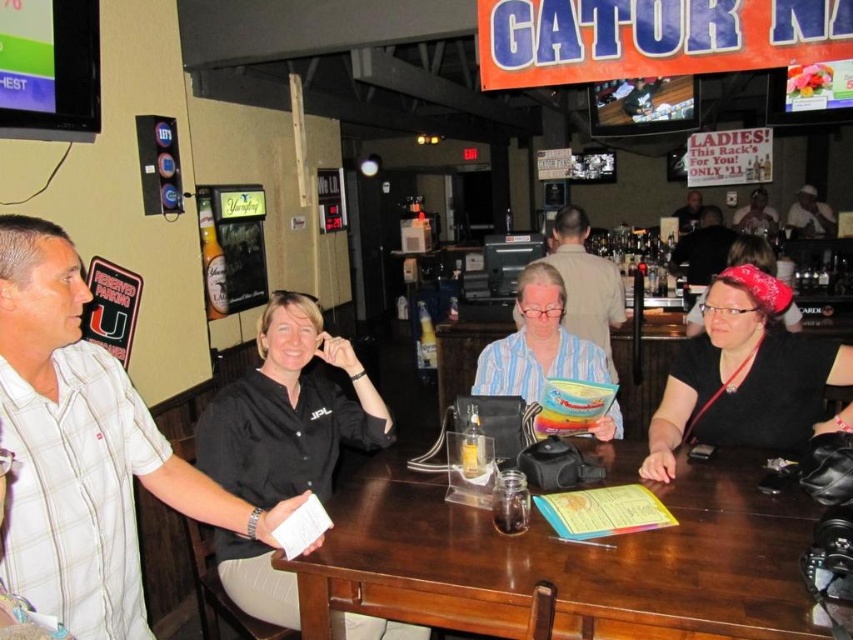
Who is lower down, brown wood table at center or black leather purse at lower right?

brown wood table at center

Between brown wood table at center and black leather purse at lower right, which one has less height?

brown wood table at center

The height and width of the screenshot is (640, 853). What are the coordinates of `brown wood table at center` in the screenshot? It's located at (567, 563).

You are a GUI agent. You are given a task and a screenshot of the screen. Output one action in this format:
    pyautogui.click(x=<x>, y=<y>)
    Task: Click on the brown wood table at center
    
    Given the screenshot: What is the action you would take?
    pyautogui.click(x=567, y=563)

Does black leather purse at lower right appear on the left side of striped cotton shirt at center?

Incorrect, black leather purse at lower right is not on the left side of striped cotton shirt at center.

Does black leather purse at lower right appear on the right side of striped cotton shirt at center?

Indeed, black leather purse at lower right is positioned on the right side of striped cotton shirt at center.

Between point (691, 392) and point (585, 349), which one is positioned behind?

Positioned behind is point (585, 349).

Where is `black leather purse at lower right`? black leather purse at lower right is located at coordinates [746, 376].

Between point (712, 538) and point (469, 452), which one is positioned behind?

The point (469, 452) is behind.

The width and height of the screenshot is (853, 640). Describe the element at coordinates (567, 563) in the screenshot. I see `brown wood table at center` at that location.

The image size is (853, 640). What are the coordinates of `brown wood table at center` in the screenshot? It's located at (567, 563).